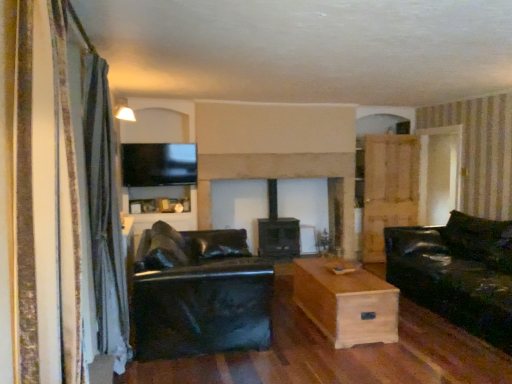
Question: From the image's perspective, is striped fabric curtain at left, placed as the 1th curtain when sorted from front to back, on light brown wood armoire at right?

Choices:
 (A) yes
 (B) no

Answer: (A)

Question: Is striped fabric curtain at left, which ranks as the second curtain in back-to-front order, to the left of light brown wood armoire at right from the viewer's perspective?

Choices:
 (A) no
 (B) yes

Answer: (B)

Question: Is striped fabric curtain at left, placed as the 1th curtain when sorted from front to back, positioned with its back to light brown wood armoire at right?

Choices:
 (A) no
 (B) yes

Answer: (A)

Question: From a real-world perspective, is striped fabric curtain at left, placed as the 1th curtain when sorted from front to back, physically below light brown wood armoire at right?

Choices:
 (A) no
 (B) yes

Answer: (A)

Question: Is striped fabric curtain at left, which ranks as the second curtain in back-to-front order, bigger than light brown wood armoire at right?

Choices:
 (A) yes
 (B) no

Answer: (A)

Question: Is striped fabric curtain at left, which ranks as the second curtain in back-to-front order, positioned beyond the bounds of light brown wood armoire at right?

Choices:
 (A) no
 (B) yes

Answer: (B)

Question: Does gray fabric curtain at left, the first curtain viewed from the back, have a greater width compared to black leather couch at center, acting as the 1th studio couch starting from the left?

Choices:
 (A) yes
 (B) no

Answer: (B)

Question: Does gray fabric curtain at left, which appears as the second curtain when viewed from the right, appear on the right side of black leather couch at center, acting as the 2th studio couch starting from the right?

Choices:
 (A) yes
 (B) no

Answer: (B)

Question: Can you confirm if gray fabric curtain at left, which is counted as the 1th curtain, starting from the left, is bigger than black leather couch at center, acting as the 1th studio couch starting from the left?

Choices:
 (A) no
 (B) yes

Answer: (A)

Question: Considering the relative sizes of gray fabric curtain at left, the first curtain viewed from the back, and black leather couch at center, acting as the 2th studio couch starting from the right, in the image provided, is gray fabric curtain at left, the first curtain viewed from the back, taller than black leather couch at center, acting as the 2th studio couch starting from the right,?

Choices:
 (A) yes
 (B) no

Answer: (A)

Question: Considering the relative sizes of gray fabric curtain at left, the first curtain viewed from the back, and black leather couch at center, acting as the 1th studio couch starting from the left, in the image provided, is gray fabric curtain at left, the first curtain viewed from the back, shorter than black leather couch at center, acting as the 1th studio couch starting from the left,?

Choices:
 (A) yes
 (B) no

Answer: (B)

Question: Does gray fabric curtain at left, the 2th curtain positioned from the front, lie behind black leather couch at center, acting as the 2th studio couch starting from the right?

Choices:
 (A) yes
 (B) no

Answer: (B)

Question: From the image's perspective, is light brown wood armoire at right on gray fabric curtain at left, the first curtain viewed from the back?

Choices:
 (A) no
 (B) yes

Answer: (B)